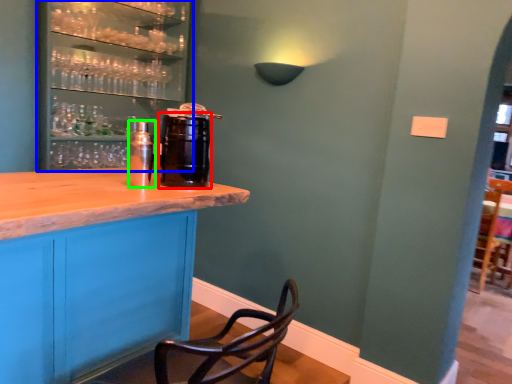
Question: Based on their relative distances, which object is farther from beverage (highlighted by a red box)? Choose from shelf (highlighted by a blue box) and beverage (highlighted by a green box).

Choices:
 (A) shelf
 (B) beverage

Answer: (A)